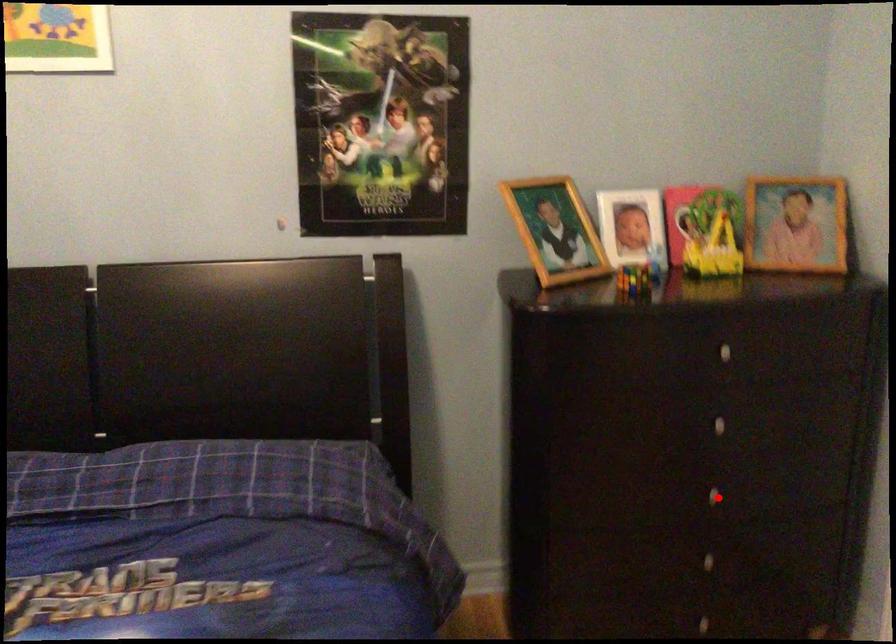
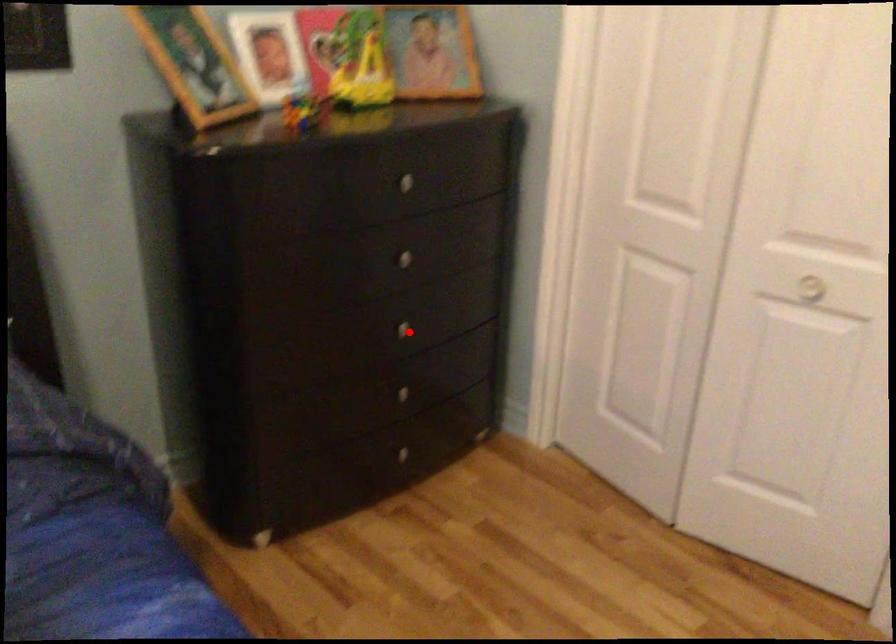
I am providing you with two images of the same scene from different viewpoints. A red point is marked on the first image and another point is marked on the second image. Is the red point in image1 aligned with the point shown in image2?

Yes